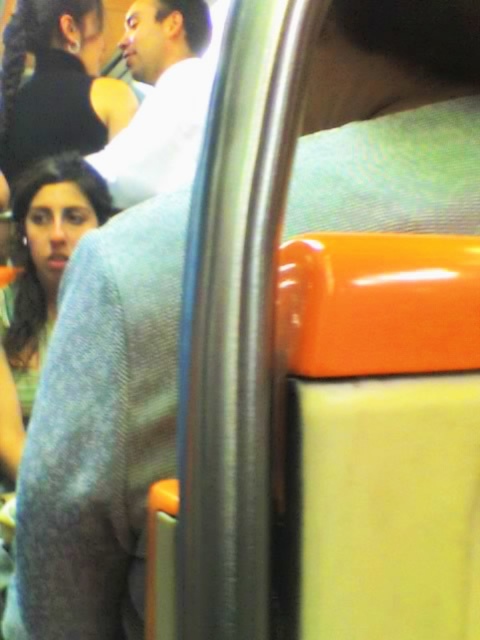
Question: Among these points, which one is farthest from the camera?

Choices:
 (A) (48, 42)
 (B) (192, 52)

Answer: (B)

Question: Which object appears closest to the camera in this image?

Choices:
 (A) white cotton shirt at upper center
 (B) matte black hair at upper left

Answer: (A)

Question: Is the position of matte black hair at upper left more distant than that of white cotton shirt at upper center?

Choices:
 (A) yes
 (B) no

Answer: (A)

Question: Which object is farther from the camera taking this photo?

Choices:
 (A) matte black hair at upper left
 (B) white cotton shirt at upper center

Answer: (A)

Question: Is the position of matte black hair at upper left less distant than that of white cotton shirt at upper center?

Choices:
 (A) yes
 (B) no

Answer: (B)

Question: Does matte black hair at upper left have a smaller size compared to white cotton shirt at upper center?

Choices:
 (A) no
 (B) yes

Answer: (B)